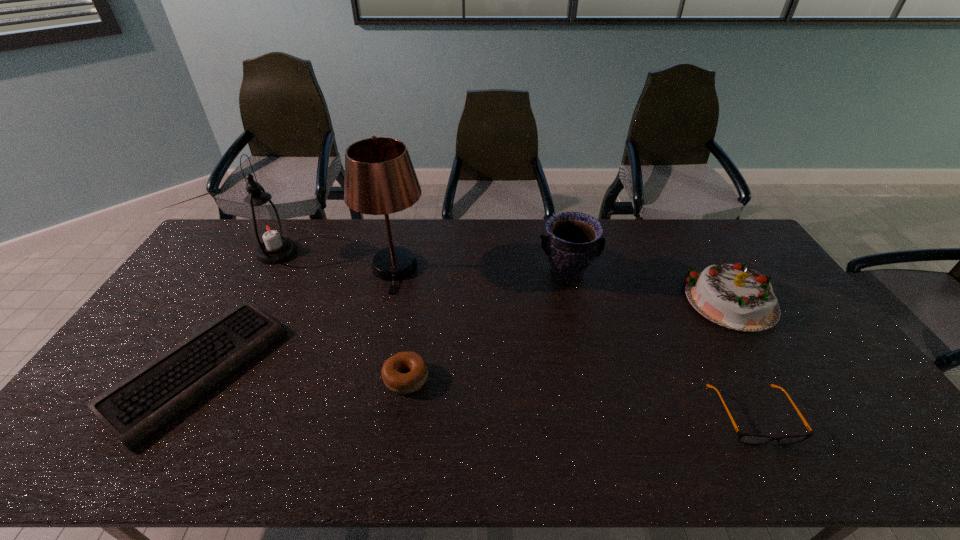
I want to click on lampshade, so click(x=380, y=179).

Locate an element on the screen. Image resolution: width=960 pixels, height=540 pixels. oil lamp is located at coordinates (267, 227).

Locate an element on the screen. the third object from right to left is located at coordinates (574, 241).

Identify the location of pottery. This screenshot has width=960, height=540. (574, 241).

You are a GUI agent. You are given a task and a screenshot of the screen. Output one action in this format:
    pyautogui.click(x=<x>, y=<y>)
    Task: Click on the fourth shortest object
    The image size is (960, 540).
    Given the screenshot: What is the action you would take?
    pyautogui.click(x=737, y=297)

At what (x,y) coordinates should I click in order to perform the action: click on bagel. Please return your answer as a coordinate pair (x, y). Looking at the image, I should click on (393, 371).

At what (x,y) coordinates should I click in order to perform the action: click on spectacles. Please return your answer as a coordinate pair (x, y). The height and width of the screenshot is (540, 960). Looking at the image, I should click on (751, 439).

At what (x,y) coordinates should I click in order to perform the action: click on computer keyboard. Please return your answer as a coordinate pair (x, y). The height and width of the screenshot is (540, 960). Looking at the image, I should click on (134, 409).

Locate an element on the screen. vacant space located on the front-facing side of the lampshade is located at coordinates (378, 337).

You are a GUI agent. You are given a task and a screenshot of the screen. Output one action in this format:
    pyautogui.click(x=<x>, y=<y>)
    Task: Click on the free space located 0.050m on the back of the oil lamp
    The width and height of the screenshot is (960, 540).
    Given the screenshot: What is the action you would take?
    pyautogui.click(x=290, y=231)